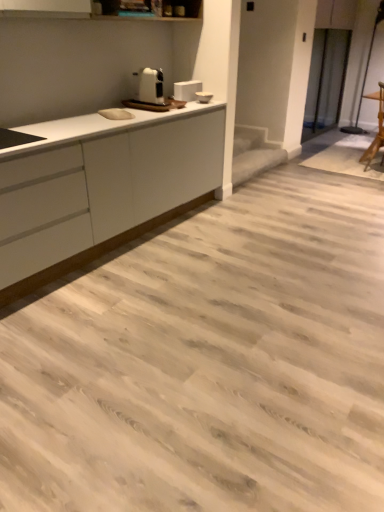
This screenshot has height=512, width=384. In order to click on vacant space situated on the left part of wooden chair at right in this screenshot , I will do `click(342, 167)`.